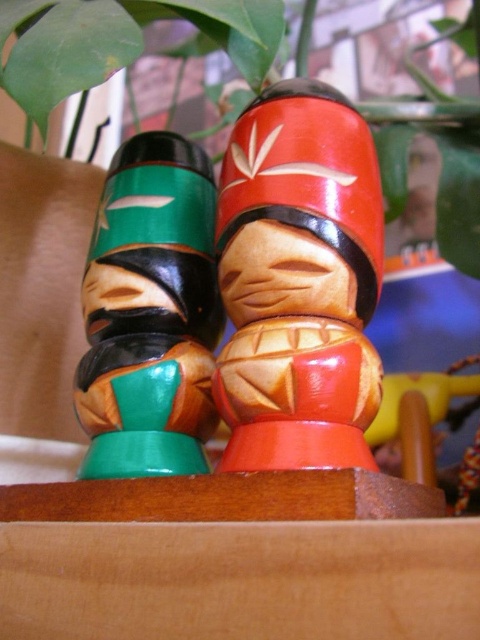
Question: Among these points, which one is nearest to the camera?

Choices:
 (A) (445, 624)
 (B) (181, 48)

Answer: (A)

Question: Which object is the closest to the green matte plant at upper center?

Choices:
 (A) green matte wooden totem at left
 (B) shiny red wood figurine at center
 (C) wooden box at center

Answer: (B)

Question: Is green matte wooden totem at left to the left of green matte plant at upper center from the viewer's perspective?

Choices:
 (A) yes
 (B) no

Answer: (A)

Question: Is shiny red wood figurine at center below green matte plant at upper center?

Choices:
 (A) no
 (B) yes

Answer: (B)

Question: Which point is farther from the camera taking this photo?

Choices:
 (A) (251, 394)
 (B) (108, 237)

Answer: (B)

Question: Is shiny red wood figurine at center above green matte wooden totem at left?

Choices:
 (A) yes
 (B) no

Answer: (A)